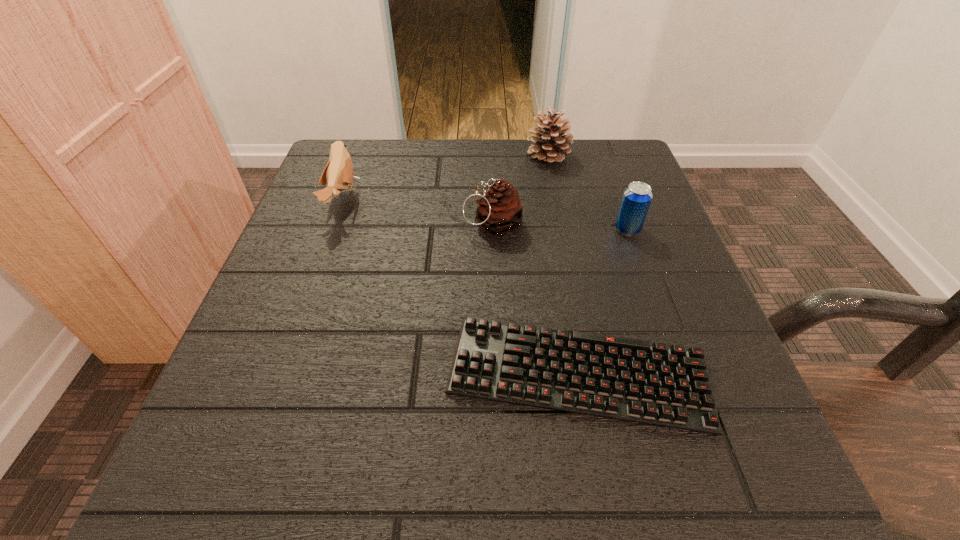
This screenshot has width=960, height=540. I want to click on free point at the near right corner, so click(705, 490).

Identify the location of free space between the nearer pinecone and the beer can. (560, 227).

This screenshot has width=960, height=540. In order to click on empty location between the beer can and the left pinecone in this screenshot , I will do `click(560, 227)`.

Locate an element on the screen. The image size is (960, 540). unoccupied position between the beer can and the shortest object is located at coordinates (603, 301).

The image size is (960, 540). What are the coordinates of `free spot between the nearest object and the bird` in the screenshot? It's located at (461, 287).

What are the coordinates of `blank region between the shortest object and the right pinecone` in the screenshot? It's located at (564, 265).

The height and width of the screenshot is (540, 960). I want to click on free spot between the beer can and the computer keyboard, so click(x=603, y=301).

Where is `vacant space in between the nearer pinecone and the computer keyboard`? vacant space in between the nearer pinecone and the computer keyboard is located at coordinates [x=536, y=299].

Locate an element on the screen. Image resolution: width=960 pixels, height=540 pixels. free space between the right pinecone and the bird is located at coordinates (445, 178).

This screenshot has height=540, width=960. I want to click on blank region between the nearest object and the bird, so click(x=461, y=287).